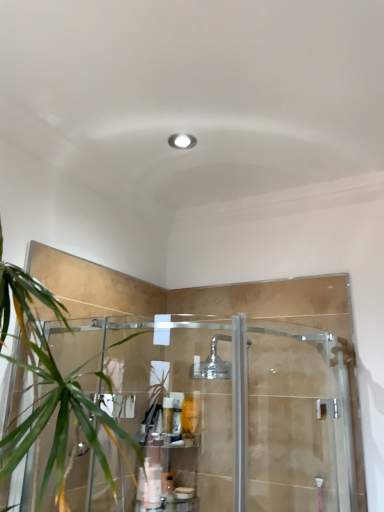
At what (x,y) coordinates should I click in order to perform the action: click on white matte bottle at lower center, which is the 2th toiletry in top-to-bottom order. Please return your answer as a coordinate pair (x, y). Image resolution: width=384 pixels, height=512 pixels. Looking at the image, I should click on (153, 484).

Measure the distance between translucent plastic bottle at center, the 3th toiletry in the bottom-to-top sequence, and camera.

translucent plastic bottle at center, the 3th toiletry in the bottom-to-top sequence, is 1.41 meters from camera.

The height and width of the screenshot is (512, 384). What are the coordinates of `polished chrome shower head at center` in the screenshot? It's located at (213, 362).

Where is `white matte bottle at lower center, which is the 2th toiletry in top-to-bottom order`? white matte bottle at lower center, which is the 2th toiletry in top-to-bottom order is located at coordinates (153, 484).

Considering the sizes of objects translucent plastic bottle at center, arranged as the 1th toiletry when viewed from the top, and white matte bottle at lower center, the second toiletry ordered from the bottom, in the image provided, who is thinner, translucent plastic bottle at center, arranged as the 1th toiletry when viewed from the top, or white matte bottle at lower center, the second toiletry ordered from the bottom,?

Thinner between the two is translucent plastic bottle at center, arranged as the 1th toiletry when viewed from the top.

How many degrees apart are the facing directions of translucent plastic bottle at center, the 3th toiletry in the bottom-to-top sequence, and white matte bottle at lower center, the second toiletry ordered from the bottom?

7.62 degrees.

From a real-world perspective, is translucent plastic bottle at center, arranged as the 1th toiletry when viewed from the top, physically above white matte bottle at lower center, the second toiletry ordered from the bottom?

Yes, from a real-world perspective, translucent plastic bottle at center, arranged as the 1th toiletry when viewed from the top, is on top of white matte bottle at lower center, the second toiletry ordered from the bottom.

Can you confirm if translucent plastic bottle at center, arranged as the 1th toiletry when viewed from the top, is positioned to the right of white matte bottle at lower center, the second toiletry ordered from the bottom?

Correct, you'll find translucent plastic bottle at center, arranged as the 1th toiletry when viewed from the top, to the right of white matte bottle at lower center, the second toiletry ordered from the bottom.

Is polished chrome shower head at center directly adjacent to translucent plastic bottle at lower center, which ranks as the 3th toiletry in top-to-bottom order?

No, polished chrome shower head at center is not next to translucent plastic bottle at lower center, which ranks as the 3th toiletry in top-to-bottom order.

From a real-world perspective, is polished chrome shower head at center physically below translucent plastic bottle at lower center, which ranks as the 3th toiletry in top-to-bottom order?

Actually, polished chrome shower head at center is physically above translucent plastic bottle at lower center, which ranks as the 3th toiletry in top-to-bottom order, in the real world.

Is polished chrome shower head at center in front of translucent plastic bottle at lower center, which ranks as the 3th toiletry in top-to-bottom order?

Yes, polished chrome shower head at center is in front of translucent plastic bottle at lower center, which ranks as the 3th toiletry in top-to-bottom order.

Can you tell me how much translucent plastic bottle at lower center, which ranks as the 3th toiletry in top-to-bottom order, and clear plastic shelf at lower center differ in facing direction?

0.000489 degrees separate the facing orientations of translucent plastic bottle at lower center, which ranks as the 3th toiletry in top-to-bottom order, and clear plastic shelf at lower center.

Can you confirm if translucent plastic bottle at lower center, positioned as the 1th toiletry in bottom-to-top order, is taller than clear plastic shelf at lower center?

No, translucent plastic bottle at lower center, positioned as the 1th toiletry in bottom-to-top order, is not taller than clear plastic shelf at lower center.

From a real-world perspective, does translucent plastic bottle at lower center, which ranks as the 3th toiletry in top-to-bottom order, sit lower than clear plastic shelf at lower center?

Yes, from a real-world perspective, translucent plastic bottle at lower center, which ranks as the 3th toiletry in top-to-bottom order, is below clear plastic shelf at lower center.

Which object is positioned more to the right, translucent plastic bottle at lower center, positioned as the 1th toiletry in bottom-to-top order, or polished chrome shower head at center?

From the viewer's perspective, polished chrome shower head at center appears more on the right side.

Considering the relative sizes of translucent plastic bottle at lower center, which ranks as the 3th toiletry in top-to-bottom order, and polished chrome shower head at center in the image provided, is translucent plastic bottle at lower center, which ranks as the 3th toiletry in top-to-bottom order, smaller than polished chrome shower head at center?

Yes.

Considering the relative sizes of translucent plastic bottle at lower center, positioned as the 1th toiletry in bottom-to-top order, and polished chrome shower head at center in the image provided, is translucent plastic bottle at lower center, positioned as the 1th toiletry in bottom-to-top order, taller than polished chrome shower head at center?

Incorrect, the height of translucent plastic bottle at lower center, positioned as the 1th toiletry in bottom-to-top order, is not larger of that of polished chrome shower head at center.

Who is bigger, polished chrome shower head at center or white matte bottle at lower center, the second toiletry ordered from the bottom?

polished chrome shower head at center is bigger.

Between polished chrome shower head at center and white matte bottle at lower center, which is the 2th toiletry in top-to-bottom order, which one has smaller width?

With smaller width is white matte bottle at lower center, which is the 2th toiletry in top-to-bottom order.

Consider the image. Is polished chrome shower head at center facing towards white matte bottle at lower center, which is the 2th toiletry in top-to-bottom order?

No, polished chrome shower head at center is not oriented towards white matte bottle at lower center, which is the 2th toiletry in top-to-bottom order.

From a real-world perspective, which object stands above the other?

polished chrome shower head at center is physically above.

Is clear plastic shelf at lower center positioned with its back to translucent plastic bottle at center, the 3th toiletry in the bottom-to-top sequence?

No, translucent plastic bottle at center, the 3th toiletry in the bottom-to-top sequence, is not at the back of clear plastic shelf at lower center.

Does point (188, 461) lie in front of point (165, 429)?

No.

Considering the positions of objects clear plastic shelf at lower center and translucent plastic bottle at center, the 3th toiletry in the bottom-to-top sequence, in the image provided, who is more to the right, clear plastic shelf at lower center or translucent plastic bottle at center, the 3th toiletry in the bottom-to-top sequence,?

Positioned to the right is translucent plastic bottle at center, the 3th toiletry in the bottom-to-top sequence.

Can you tell me how much clear plastic shelf at lower center and translucent plastic bottle at center, arranged as the 1th toiletry when viewed from the top, differ in facing direction?

clear plastic shelf at lower center and translucent plastic bottle at center, arranged as the 1th toiletry when viewed from the top, are facing 7.62 degrees away from each other.

Is translucent plastic bottle at lower center, which ranks as the 3th toiletry in top-to-bottom order, further to the viewer compared to white matte bottle at lower center, which is the 2th toiletry in top-to-bottom order?

Yes.

Between translucent plastic bottle at lower center, which ranks as the 3th toiletry in top-to-bottom order, and white matte bottle at lower center, which is the 2th toiletry in top-to-bottom order, which one has smaller size?

translucent plastic bottle at lower center, which ranks as the 3th toiletry in top-to-bottom order.

Could you measure the distance between translucent plastic bottle at lower center, positioned as the 1th toiletry in bottom-to-top order, and white matte bottle at lower center, the second toiletry ordered from the bottom?

translucent plastic bottle at lower center, positioned as the 1th toiletry in bottom-to-top order, and white matte bottle at lower center, the second toiletry ordered from the bottom, are 1.12 meters apart from each other.

Considering the relative positions of translucent plastic bottle at lower center, positioned as the 1th toiletry in bottom-to-top order, and white matte bottle at lower center, the second toiletry ordered from the bottom, in the image provided, is translucent plastic bottle at lower center, positioned as the 1th toiletry in bottom-to-top order, to the left or to the right of white matte bottle at lower center, the second toiletry ordered from the bottom,?

Based on their positions, translucent plastic bottle at lower center, positioned as the 1th toiletry in bottom-to-top order, is located to the right of white matte bottle at lower center, the second toiletry ordered from the bottom.

Locate an element on the screen. This screenshot has width=384, height=512. toiletry above the white matte bottle at lower center, the second toiletry ordered from the bottom (from the image's perspective) is located at coordinates (167, 415).

The width and height of the screenshot is (384, 512). In order to click on shower above the translucent plastic bottle at lower center, positioned as the 1th toiletry in bottom-to-top order (from a real-world perspective) in this screenshot , I will do `click(213, 362)`.

Which object lies nearer to the anchor point polished chrome shower head at center, clear plastic shelf at lower center or translucent plastic bottle at center, the 3th toiletry in the bottom-to-top sequence?

translucent plastic bottle at center, the 3th toiletry in the bottom-to-top sequence, lies closer to polished chrome shower head at center than the other object.

Looking at the image, which one is located further to white matte bottle at lower center, the second toiletry ordered from the bottom, translucent plastic bottle at lower center, which ranks as the 3th toiletry in top-to-bottom order, or translucent plastic bottle at center, arranged as the 1th toiletry when viewed from the top?

Based on the image, translucent plastic bottle at lower center, which ranks as the 3th toiletry in top-to-bottom order, appears to be further to white matte bottle at lower center, the second toiletry ordered from the bottom.

From the image, which object appears to be farther from clear plastic shelf at lower center, translucent plastic bottle at center, the 3th toiletry in the bottom-to-top sequence, or translucent plastic bottle at lower center, positioned as the 1th toiletry in bottom-to-top order?

translucent plastic bottle at lower center, positioned as the 1th toiletry in bottom-to-top order, is further to clear plastic shelf at lower center.

In the scene shown: From the image, which object appears to be farther from white matte bottle at lower center, which is the 2th toiletry in top-to-bottom order, clear plastic shelf at lower center or translucent plastic bottle at center, the 3th toiletry in the bottom-to-top sequence?

translucent plastic bottle at center, the 3th toiletry in the bottom-to-top sequence, is positioned further to the anchor white matte bottle at lower center, which is the 2th toiletry in top-to-bottom order.

From the image, which object appears to be farther from translucent plastic bottle at center, arranged as the 1th toiletry when viewed from the top, translucent plastic bottle at lower center, positioned as the 1th toiletry in bottom-to-top order, or clear plastic shelf at lower center?

translucent plastic bottle at lower center, positioned as the 1th toiletry in bottom-to-top order, lies further to translucent plastic bottle at center, arranged as the 1th toiletry when viewed from the top, than the other object.

When comparing their distances from polished chrome shower head at center, does translucent plastic bottle at center, the 3th toiletry in the bottom-to-top sequence, or translucent plastic bottle at lower center, which ranks as the 3th toiletry in top-to-bottom order, seem closer?

Based on the image, translucent plastic bottle at center, the 3th toiletry in the bottom-to-top sequence, appears to be nearer to polished chrome shower head at center.

From the image, which object appears to be nearer to translucent plastic bottle at center, arranged as the 1th toiletry when viewed from the top, clear plastic shelf at lower center or white matte bottle at lower center, the second toiletry ordered from the bottom?

clear plastic shelf at lower center is positioned closer to the anchor translucent plastic bottle at center, arranged as the 1th toiletry when viewed from the top.

Estimate the real-world distances between objects in this image. Which object is further from white matte bottle at lower center, the second toiletry ordered from the bottom, translucent plastic bottle at center, the 3th toiletry in the bottom-to-top sequence, or polished chrome shower head at center?

polished chrome shower head at center is further to white matte bottle at lower center, the second toiletry ordered from the bottom.

The height and width of the screenshot is (512, 384). What are the coordinates of `toiletry between translucent plastic bottle at center, the 3th toiletry in the bottom-to-top sequence, and translucent plastic bottle at lower center, positioned as the 1th toiletry in bottom-to-top order, vertically` in the screenshot? It's located at (153, 484).

Where is `shelf between translucent plastic bottle at center, arranged as the 1th toiletry when viewed from the top, and translucent plastic bottle at lower center, positioned as the 1th toiletry in bottom-to-top order, vertically`? This screenshot has width=384, height=512. shelf between translucent plastic bottle at center, arranged as the 1th toiletry when viewed from the top, and translucent plastic bottle at lower center, positioned as the 1th toiletry in bottom-to-top order, vertically is located at coordinates (169, 474).

Where is `shelf between polished chrome shower head at center and white matte bottle at lower center, the second toiletry ordered from the bottom, vertically`? The image size is (384, 512). shelf between polished chrome shower head at center and white matte bottle at lower center, the second toiletry ordered from the bottom, vertically is located at coordinates (169, 474).

The image size is (384, 512). I want to click on shelf between translucent plastic bottle at center, arranged as the 1th toiletry when viewed from the top, and white matte bottle at lower center, which is the 2th toiletry in top-to-bottom order, in the up-down direction, so click(x=169, y=474).